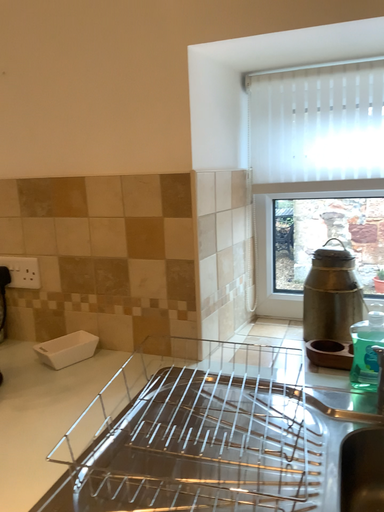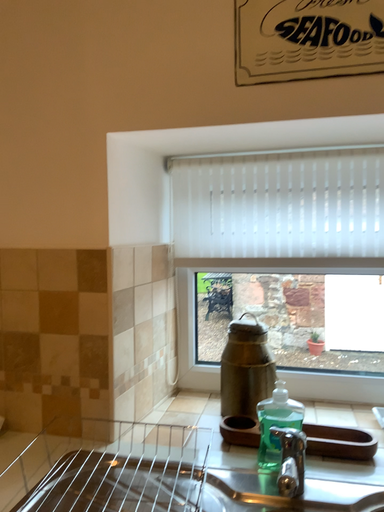
Question: Which way did the camera rotate in the video?

Choices:
 (A) rotated right
 (B) rotated left

Answer: (A)